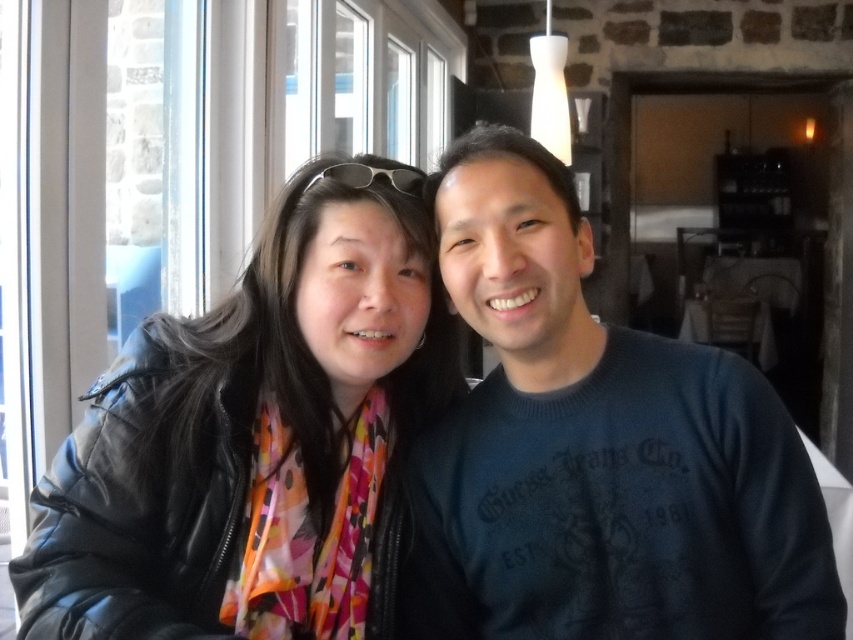
Between matte black jacket at center and dark blue sweater at center, which one appears on the left side from the viewer's perspective?

From the viewer's perspective, matte black jacket at center appears more on the left side.

Which is below, matte black jacket at center or dark blue sweater at center?

Positioned lower is matte black jacket at center.

Who is more forward, (195,547) or (589,272)?

Point (589,272) is in front.

Find the location of `matte black jacket at center`. matte black jacket at center is located at coordinates (260, 445).

Does dark blue sweater at center appear over sunglasses at center?

No.

Which is below, dark blue sweater at center or sunglasses at center?

dark blue sweater at center is lower down.

Does point (793, 451) come in front of point (323, 176)?

Yes, it is in front of point (323, 176).

Where is `dark blue sweater at center`? Image resolution: width=853 pixels, height=640 pixels. dark blue sweater at center is located at coordinates (606, 442).

Can you confirm if matte black jacket at center is shorter than sunglasses at center?

No.

Between matte black jacket at center and sunglasses at center, which one is positioned higher?

sunglasses at center is above.

Is point (77, 547) positioned after point (345, 170)?

No.

This screenshot has width=853, height=640. In order to click on matte black jacket at center in this screenshot , I will do `click(260, 445)`.